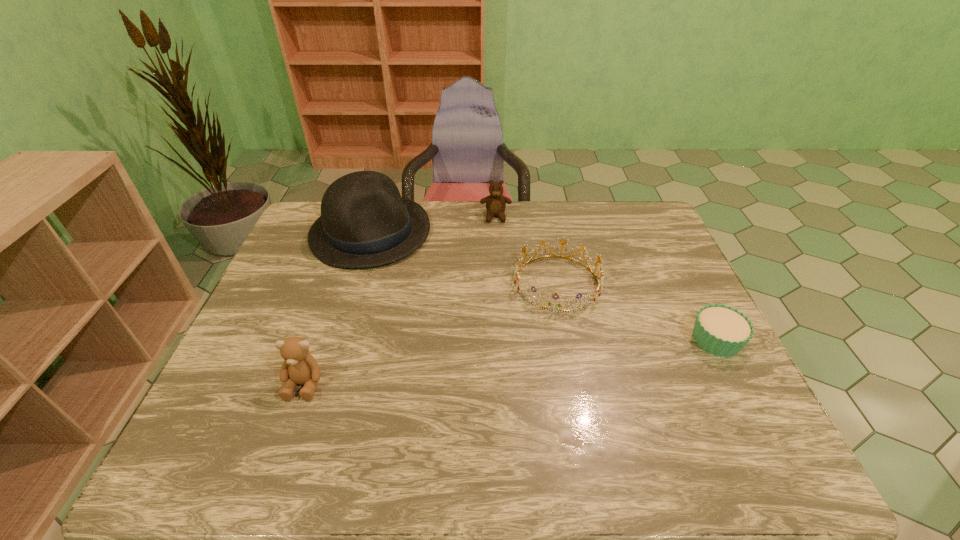
The image size is (960, 540). I want to click on free spot between the right teddy bear and the left teddy bear, so click(400, 300).

This screenshot has height=540, width=960. What are the coordinates of `object that is the fourth closest one to the bowler hat` in the screenshot? It's located at (720, 330).

This screenshot has width=960, height=540. Identify the location of object that is the closest to the farther teddy bear. (561, 309).

This screenshot has height=540, width=960. I want to click on free space that satisfies the following two spatial constraints: 1. on the front side of the bowler hat; 2. on the left side of the fourth tallest object, so click(x=355, y=283).

You are a GUI agent. You are given a task and a screenshot of the screen. Output one action in this format:
    pyautogui.click(x=<x>, y=<y>)
    Task: Click on the free location that satisfies the following two spatial constraints: 1. on the back side of the bowler hat; 2. on the left side of the right teddy bear
    Image resolution: width=960 pixels, height=540 pixels.
    Given the screenshot: What is the action you would take?
    pyautogui.click(x=375, y=217)

Find the location of a particular element. This screenshot has width=960, height=540. free spot that satisfies the following two spatial constraints: 1. on the front side of the farther teddy bear; 2. on the left side of the tiara is located at coordinates (499, 283).